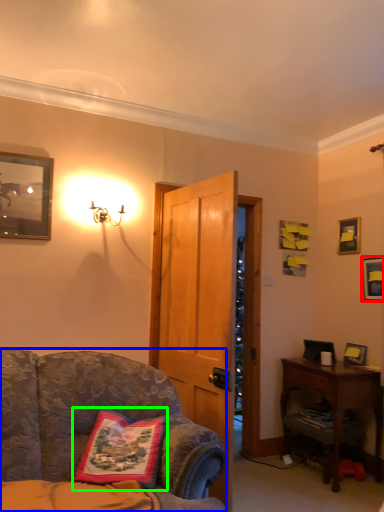
Question: Considering the real-world distances, which object is closest to picture frame (highlighted by a red box)? chair (highlighted by a blue box) or pillow (highlighted by a green box).

Choices:
 (A) chair
 (B) pillow

Answer: (A)